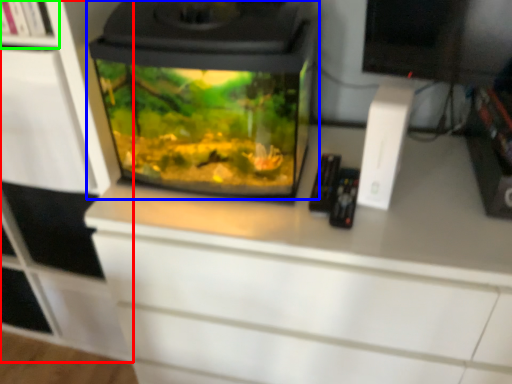
Question: Estimate the real-world distances between objects in this image. Which object is closer to cabinetry (highlighted by a red box), home appliance (highlighted by a blue box) or shelf (highlighted by a green box)?

Choices:
 (A) home appliance
 (B) shelf

Answer: (A)